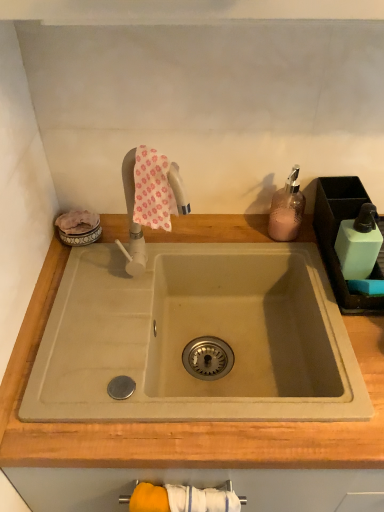
You are a GUI agent. You are given a task and a screenshot of the screen. Output one action in this format:
    pyautogui.click(x=<x>, y=<y>)
    Task: Click on the vacant area that is in front of light green plastic soap dispenser at right
    
    Given the screenshot: What is the action you would take?
    pyautogui.click(x=346, y=316)